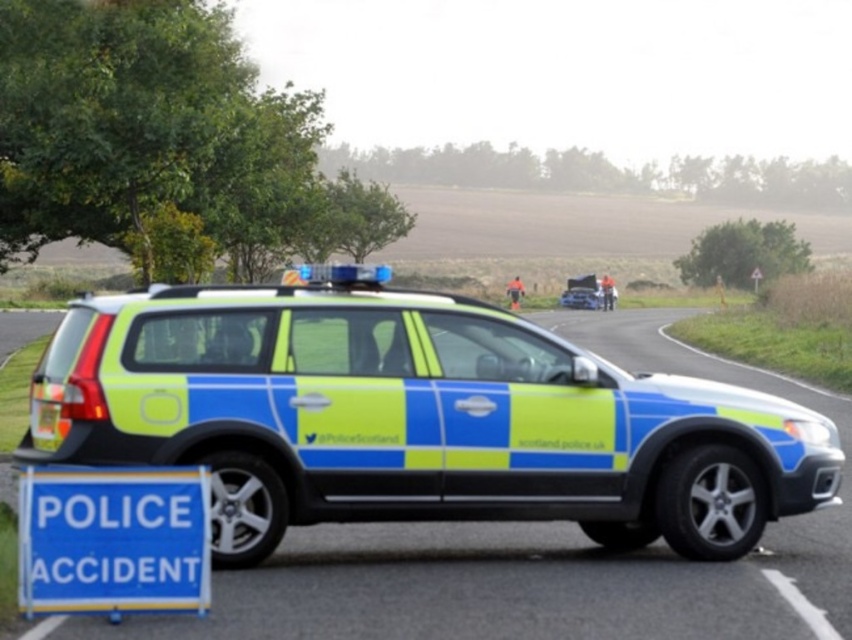
Question: Which point is farther from the camera taking this photo?

Choices:
 (A) [580, 307]
 (B) [661, 467]
 (C) [79, 497]

Answer: (A)

Question: Does matte metallic police car at center appear on the right side of blue glossy police car at center?

Choices:
 (A) no
 (B) yes

Answer: (A)

Question: Does metallic silver car at center appear over neon green plastic police car at center?

Choices:
 (A) no
 (B) yes

Answer: (A)

Question: Does blue plastic sign at lower left come behind blue glossy police car at center?

Choices:
 (A) no
 (B) yes

Answer: (A)

Question: Which object appears farthest from the camera in this image?

Choices:
 (A) blue plastic sign at lower left
 (B) metallic silver car at center
 (C) neon green plastic police car at center

Answer: (B)

Question: Which point appears closest to the camera in this image?

Choices:
 (A) (27, 493)
 (B) (508, 292)
 (C) (611, 300)

Answer: (A)